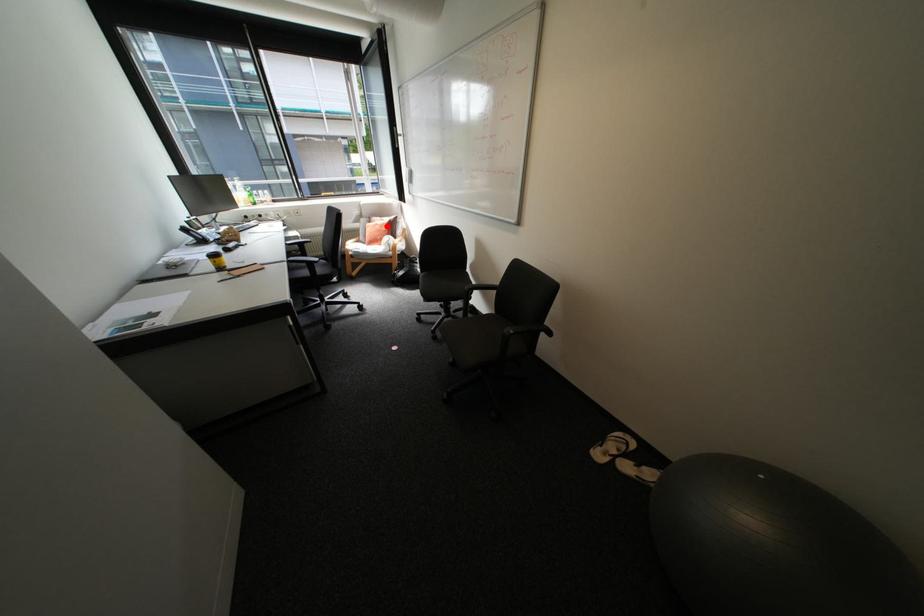
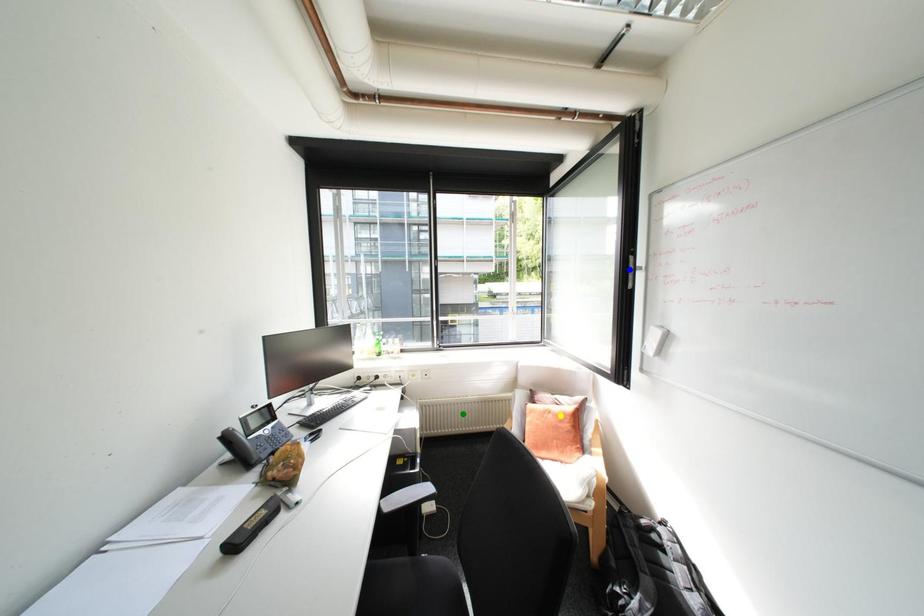
Question: I am providing you with two images of the same scene from different viewpoints. A red point is marked on the first image. You are given multiple points on the second image. Which point in image 2 is actually the same real-world point as the red point in image 1?

Choices:
 (A) green point
 (B) yellow point
 (C) blue point

Answer: (B)